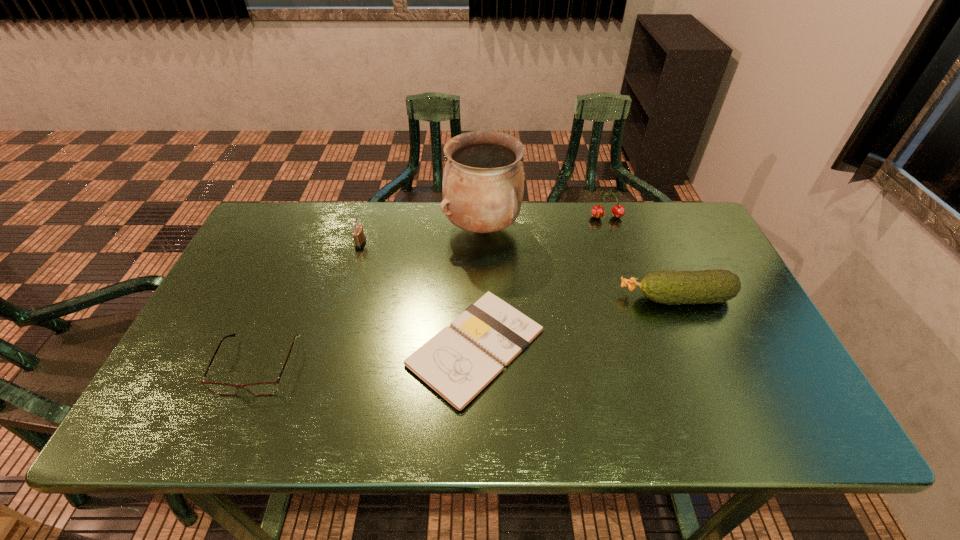
Identify the location of vacant space situated 0.270m at the blossom end of the cucumber. (518, 298).

In order to click on vacant position located 0.130m at the blossom end of the cucumber in this screenshot , I will do `click(570, 298)`.

Where is `blank area located 0.270m at the blossom end of the cucumber`? Image resolution: width=960 pixels, height=540 pixels. blank area located 0.270m at the blossom end of the cucumber is located at coordinates (518, 298).

Find the location of `vacant area located on the lenses of the second shortest object`. vacant area located on the lenses of the second shortest object is located at coordinates (231, 431).

Identify the location of vacant space located 0.390m on the back of the shortest object. (477, 208).

Identify the location of urn located at the far edge. This screenshot has width=960, height=540. (483, 185).

The image size is (960, 540). I want to click on cherry present at the far edge, so click(618, 211).

Identify the location of padlock positioned at the far edge. Image resolution: width=960 pixels, height=540 pixels. (359, 238).

Image resolution: width=960 pixels, height=540 pixels. Find the location of `object that is at the near edge`. object that is at the near edge is located at coordinates (458, 367).

In order to click on object at the left edge in this screenshot , I will do `click(265, 388)`.